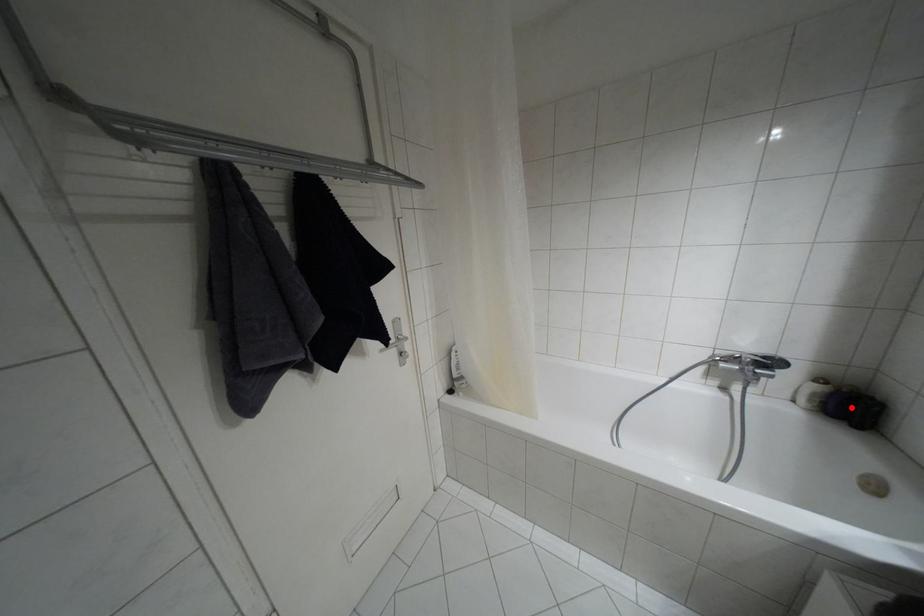
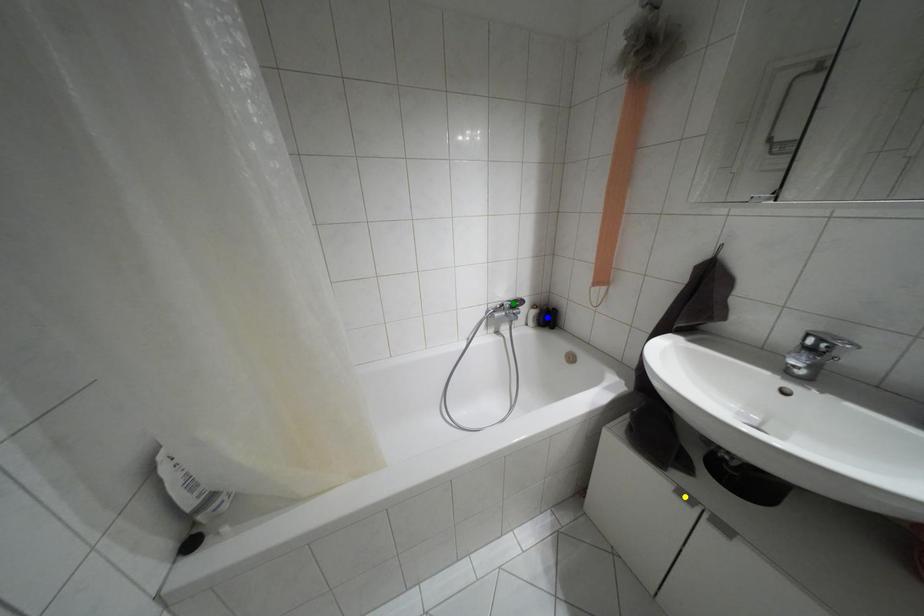
Question: I am providing you with two images of the same scene from different viewpoints. A red point is marked on the first image. You are given multiple points on the second image. Which spot in image 2 lines up with the point in image 1?

Choices:
 (A) blue point
 (B) yellow point
 (C) green point

Answer: (A)